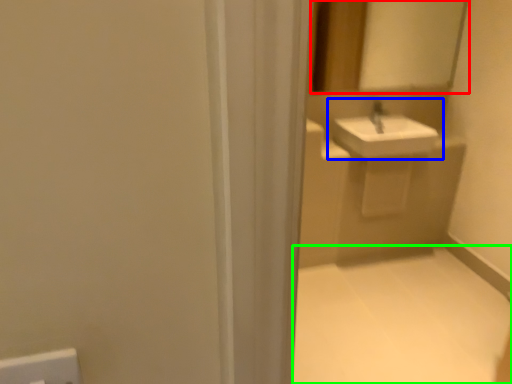
Question: Based on their relative distances, which object is nearer to mirror (highlighted by a red box)? Choose from sink (highlighted by a blue box) and plain (highlighted by a green box).

Choices:
 (A) sink
 (B) plain

Answer: (A)